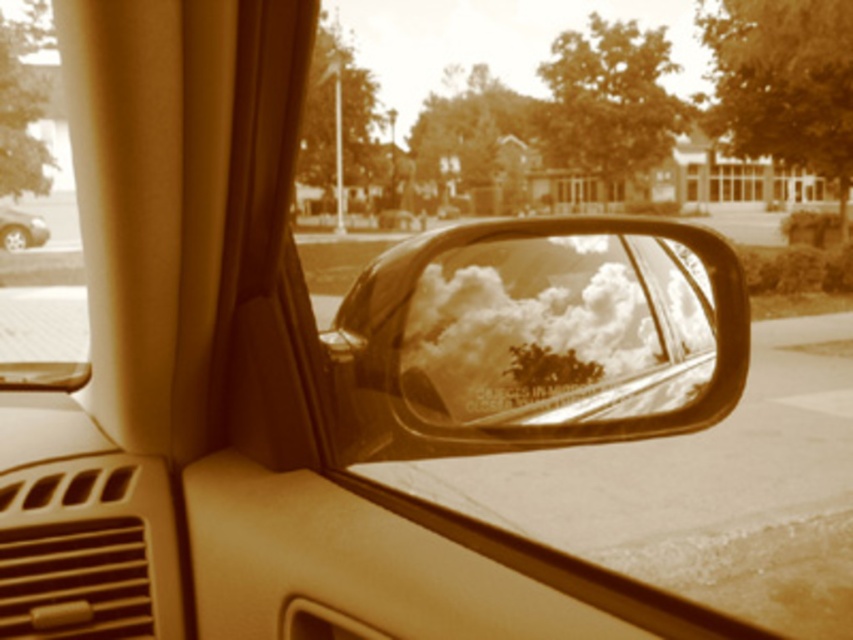
You are inside a car with a vintage sepia tone view. You notice a point at coordinates [538,337]. What object is located at that point?

The shiny reflective mirror at center is located at point [538,337].

You are sitting in the driver seat of the car and want to check both the shiny reflective mirror at center and the matte plastic dashboard at lower left. Which object is positioned to the right from your perspective?

The shiny reflective mirror at center is positioned to the right of the matte plastic dashboard at lower left from your perspective.